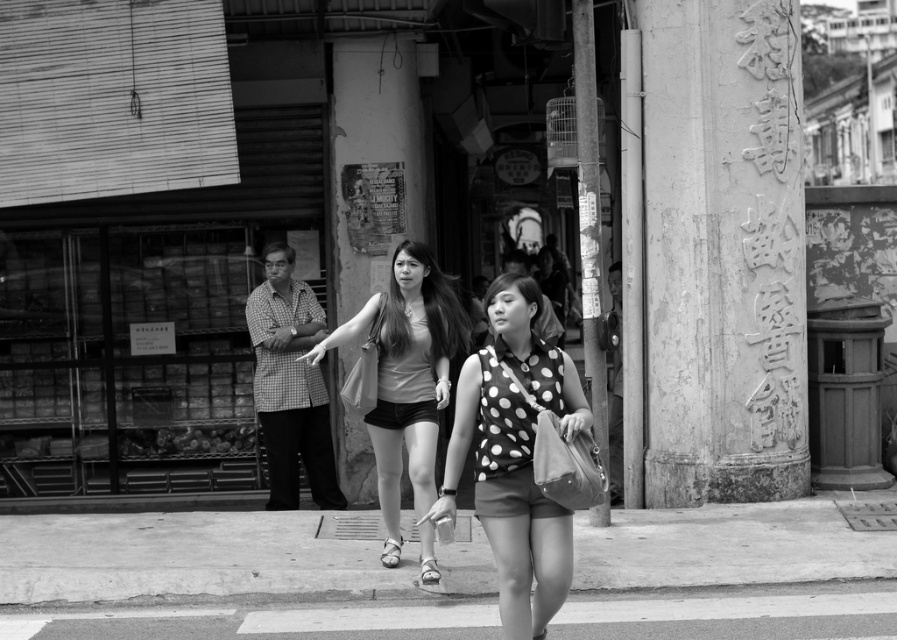
Question: Where is asphalt pavement at center located in relation to polka dot fabric top at center in the image?

Choices:
 (A) below
 (B) above

Answer: (A)

Question: Which of the following is the closest to the observer?

Choices:
 (A) (371, 186)
 (B) (759, 468)
 (C) (835, 636)

Answer: (C)

Question: Which point is farther to the camera?

Choices:
 (A) asphalt pavement at center
 (B) matte gray tank top at center
 (C) polka dot fabric top at center
 (D) weathered stone pillar at right

Answer: (D)

Question: Can you confirm if asphalt pavement at center is bigger than smooth concrete pillar at center?

Choices:
 (A) no
 (B) yes

Answer: (A)

Question: Is smooth concrete pillar at center positioned at the back of matte gray tank top at center?

Choices:
 (A) yes
 (B) no

Answer: (A)

Question: Which of the following is the farthest from the observer?

Choices:
 (A) (586, 140)
 (B) (46, 625)

Answer: (A)